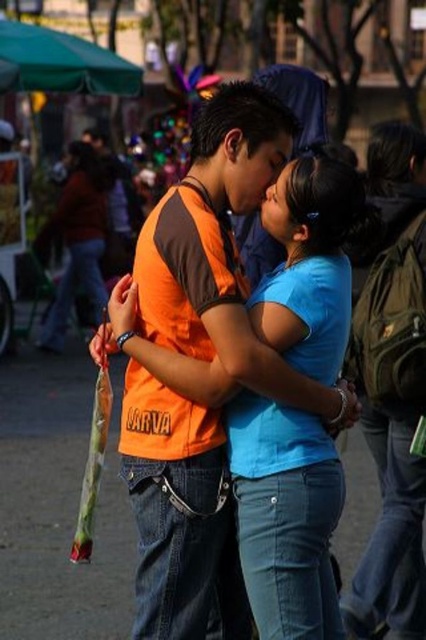
Question: Does orange cotton shirt at center appear on the right side of blue matte shirt at center?

Choices:
 (A) no
 (B) yes

Answer: (B)

Question: Which is farther from the orange cotton shirt at center?

Choices:
 (A) blue denim jeans at center
 (B) blue matte shirt at center

Answer: (B)

Question: Can you confirm if orange cotton shirt at center is positioned above blue denim jeans at center?

Choices:
 (A) yes
 (B) no

Answer: (A)

Question: Which point is farther from the camera taking this photo?

Choices:
 (A) (299, 602)
 (B) (72, 291)

Answer: (B)

Question: Among these points, which one is farthest from the camera?

Choices:
 (A) (258, 358)
 (B) (60, 212)
 (C) (322, 435)

Answer: (B)

Question: Is orange cotton shirt at center to the right of blue matte shirt at center from the viewer's perspective?

Choices:
 (A) no
 (B) yes

Answer: (B)